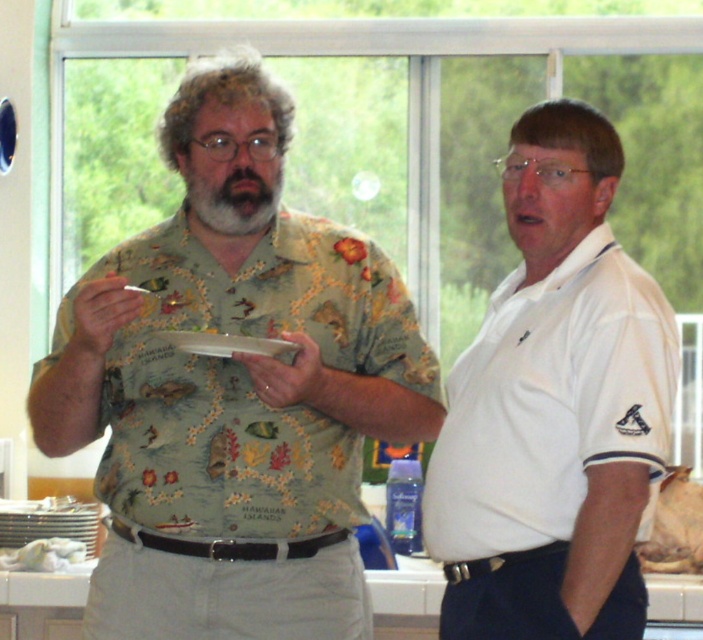
Question: Is floral cotton shirt at center closer to camera compared to brown crumbly bread at right?

Choices:
 (A) no
 (B) yes

Answer: (B)

Question: Considering the real-world distances, which object is farthest from the white smooth shirt at right?

Choices:
 (A) brown crumbly bread at right
 (B) floral cotton shirt at center
 (C) white paper plate at center

Answer: (A)

Question: Is floral cotton shirt at center positioned behind white smooth shirt at right?

Choices:
 (A) no
 (B) yes

Answer: (B)

Question: Observing the image, what is the correct spatial positioning of brown crumbly bread at right in reference to white paper plate at center?

Choices:
 (A) left
 (B) right

Answer: (B)

Question: Which point is farther to the camera?

Choices:
 (A) white paper plate at center
 (B) brown crumbly bread at right
 (C) white smooth shirt at right

Answer: (B)

Question: Which object is positioned closest to the white smooth shirt at right?

Choices:
 (A) white paper plate at center
 (B) brown crumbly bread at right
 (C) floral cotton shirt at center

Answer: (C)